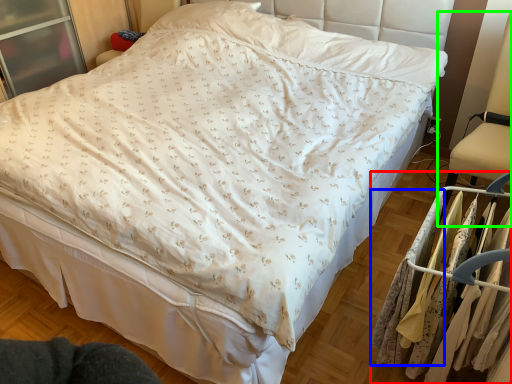
Question: Which object is positioned closest to closet (highlighted by a red box)? Select from clothing (highlighted by a blue box) and swivel chair (highlighted by a green box).

Choices:
 (A) clothing
 (B) swivel chair

Answer: (A)